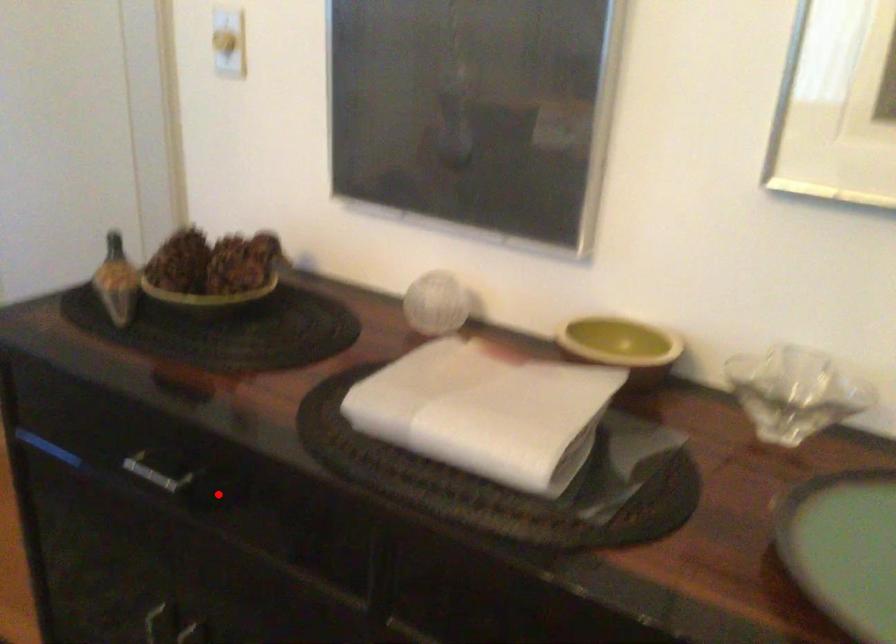
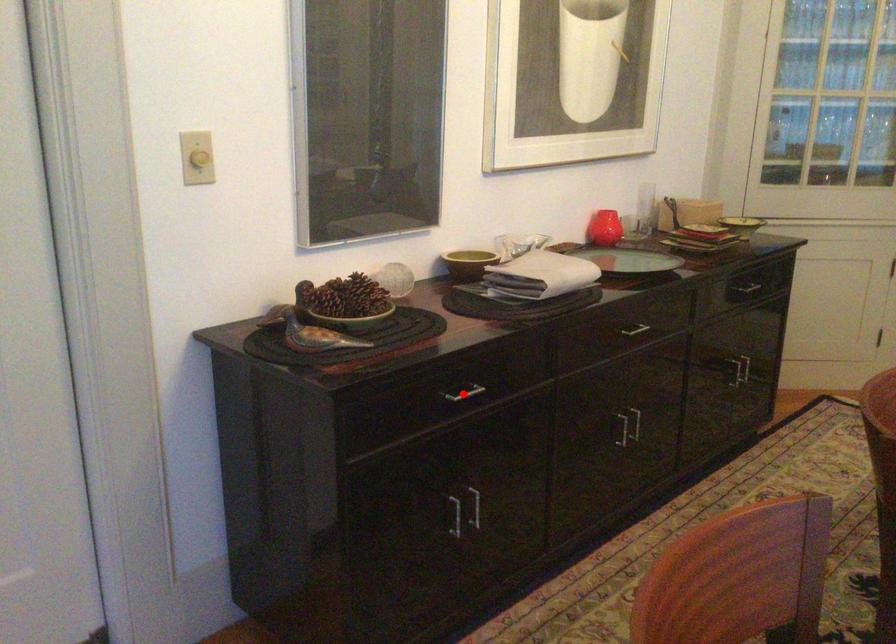
I am providing you with two images of the same scene from different viewpoints. A red point is marked on the first image and another point is marked on the second image. Is the marked point in image1 the same physical position as the marked point in image2?

Yes